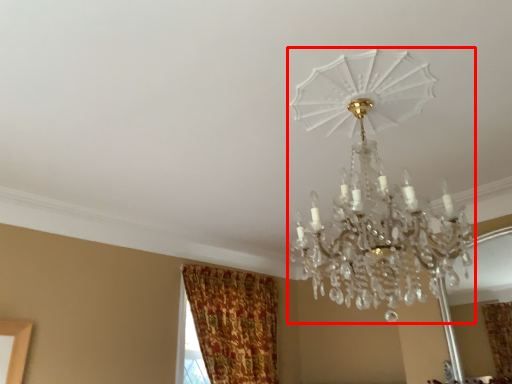
Question: From the image's perspective, considering the relative positions of lamp (annotated by the red box) and curtain in the image provided, where is lamp (annotated by the red box) located with respect to the staircase?

Choices:
 (A) below
 (B) above

Answer: (B)